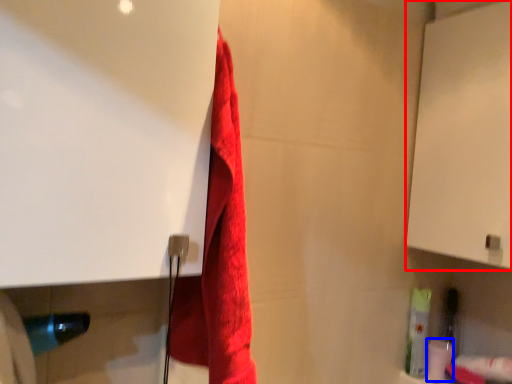
Question: Which point is closer to the camera, screen door (highlighted by a red box) or toilet paper (highlighted by a blue box)?

Choices:
 (A) screen door
 (B) toilet paper

Answer: (A)